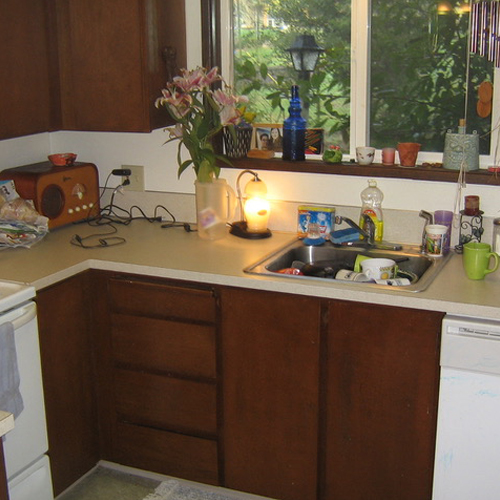
This screenshot has height=500, width=500. Identify the location of electrical cords. (139, 210), (104, 185), (116, 243).